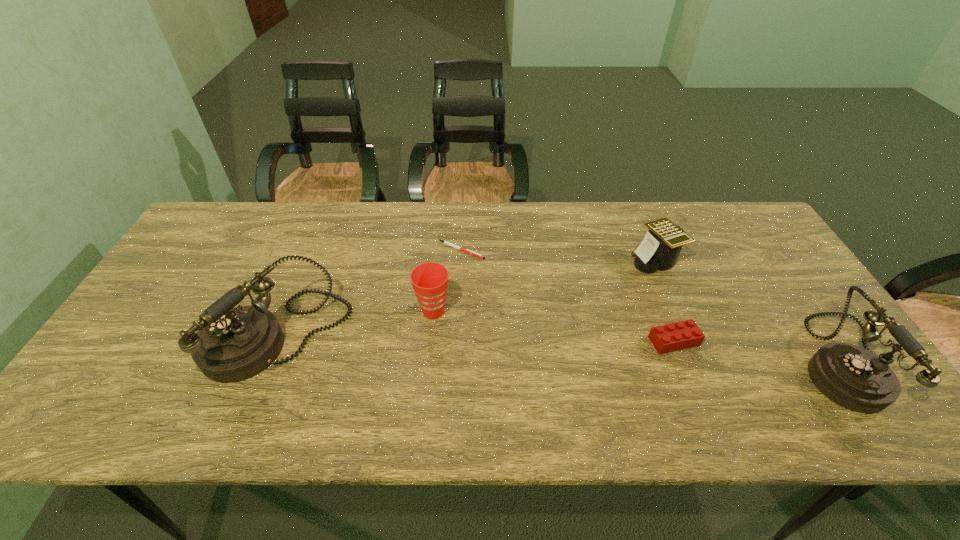
The image size is (960, 540). Identify the location of vacant space located on the left of the fourth tallest object. (577, 260).

Image resolution: width=960 pixels, height=540 pixels. What are the coordinates of `free space located on the clicker of the shortest object` in the screenshot? It's located at (587, 250).

Where is `vacant region located 0.050m on the back of the Lego`? This screenshot has width=960, height=540. vacant region located 0.050m on the back of the Lego is located at coordinates (663, 314).

The image size is (960, 540). What are the coordinates of `vacant space located on the left of the fourth shortest object` in the screenshot? It's located at (329, 311).

The height and width of the screenshot is (540, 960). What are the coordinates of `calculator that is at the far edge` in the screenshot? It's located at (659, 250).

The height and width of the screenshot is (540, 960). I want to click on pen that is at the far edge, so click(445, 242).

Locate an element on the screen. Image resolution: width=960 pixels, height=540 pixels. object located at the right edge is located at coordinates (853, 377).

You are a GUI agent. You are given a task and a screenshot of the screen. Output one action in this format:
    pyautogui.click(x=<x>, y=<y>)
    Task: Click on the object located in the near right corner section of the desktop
    
    Given the screenshot: What is the action you would take?
    pyautogui.click(x=853, y=377)

Find the location of a particular element. The width and height of the screenshot is (960, 540). free location at the far edge is located at coordinates (450, 240).

Where is `free location at the near edge`? The width and height of the screenshot is (960, 540). free location at the near edge is located at coordinates (612, 383).